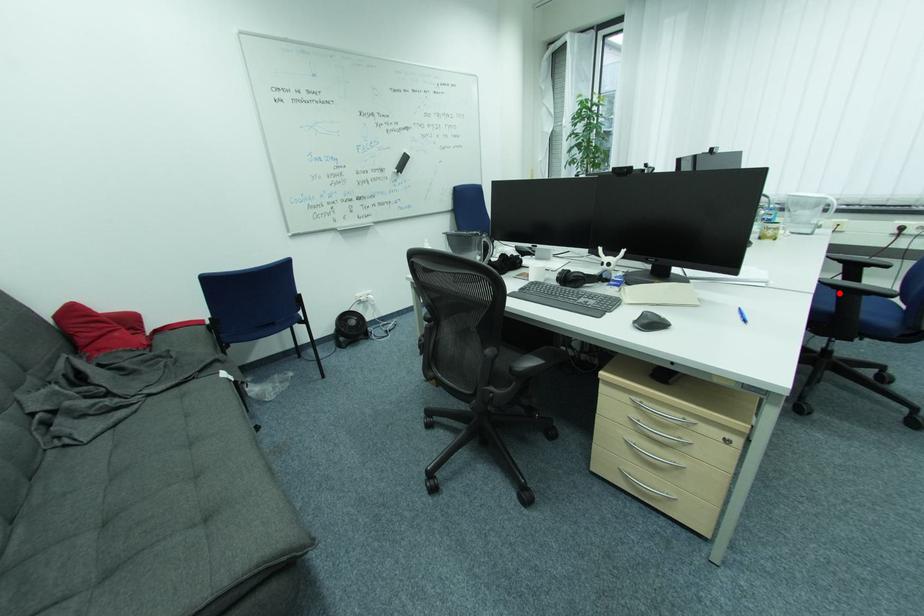
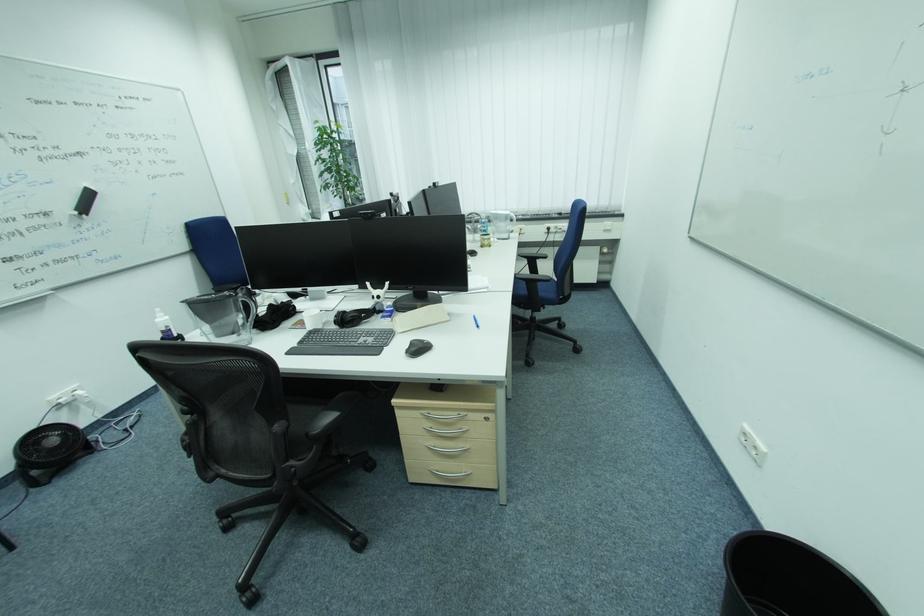
Locate, in the second image, the point that corresponds to the highlighted location in the first image.

(530, 284)